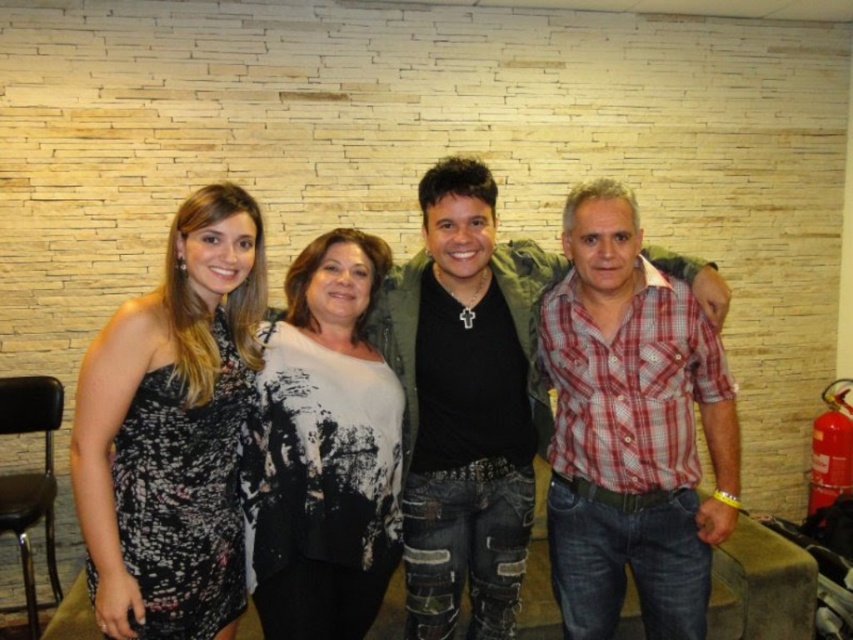
Which of these two, black satin dress at left or red plaid shirt at center, stands taller?

Standing taller between the two is red plaid shirt at center.

Does point (100, 369) come behind point (503, 579)?

No, it is not.

Locate an element on the screen. Image resolution: width=853 pixels, height=640 pixels. black satin dress at left is located at coordinates (172, 429).

Is red plaid shirt at center to the right of white textured sweater at center from the viewer's perspective?

Indeed, red plaid shirt at center is positioned on the right side of white textured sweater at center.

Does point (442, 524) lie behind point (291, 556)?

Yes, it is behind point (291, 556).

Find the location of a particular element. red plaid shirt at center is located at coordinates (466, 403).

Identify the location of black satin dress at left. (172, 429).

Is point (206, 416) farther from viewer compared to point (299, 554)?

No, (206, 416) is closer to viewer.

At what (x,y) coordinates should I click in order to perform the action: click on black satin dress at left. Please return your answer as a coordinate pair (x, y). This screenshot has width=853, height=640. Looking at the image, I should click on (172, 429).